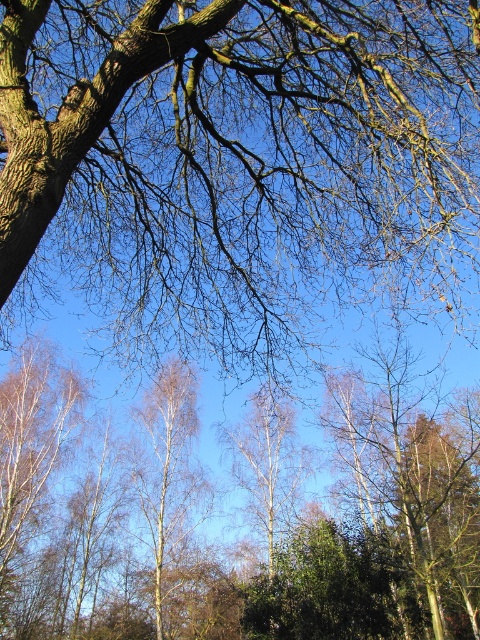
Which is more to the left, brown rough bark tree at upper left or white smooth birch tree at center?

From the viewer's perspective, white smooth birch tree at center appears more on the left side.

What do you see at coordinates (240, 154) in the screenshot? I see `brown rough bark tree at upper left` at bounding box center [240, 154].

Where is `brown rough bark tree at upper left`? brown rough bark tree at upper left is located at coordinates (240, 154).